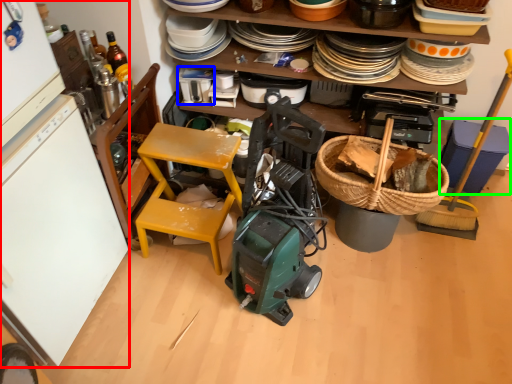
Question: Estimate the real-world distances between objects in this image. Which object is farther from refrigerator (highlighted by a red box), appliance (highlighted by a blue box) or appliance (highlighted by a green box)?

Choices:
 (A) appliance
 (B) appliance

Answer: (B)